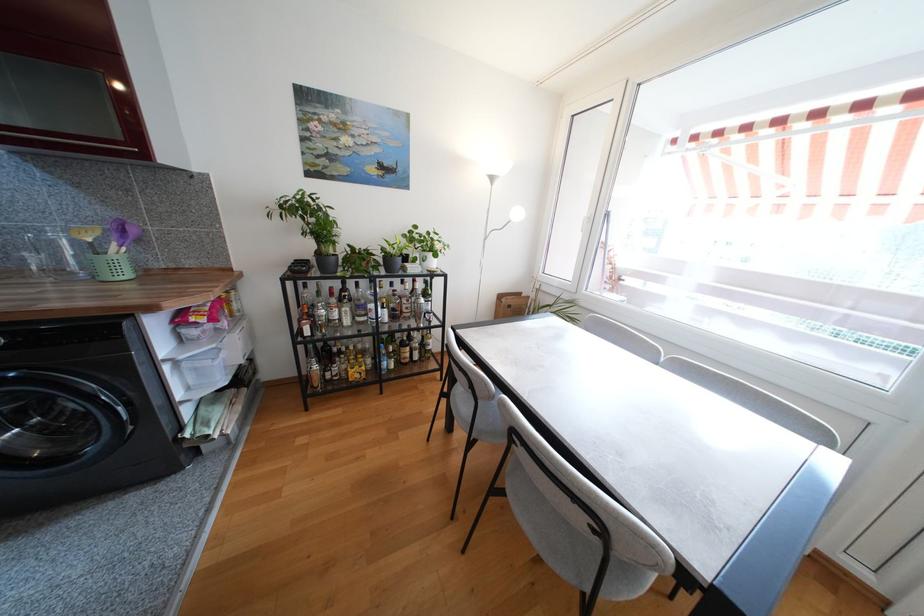
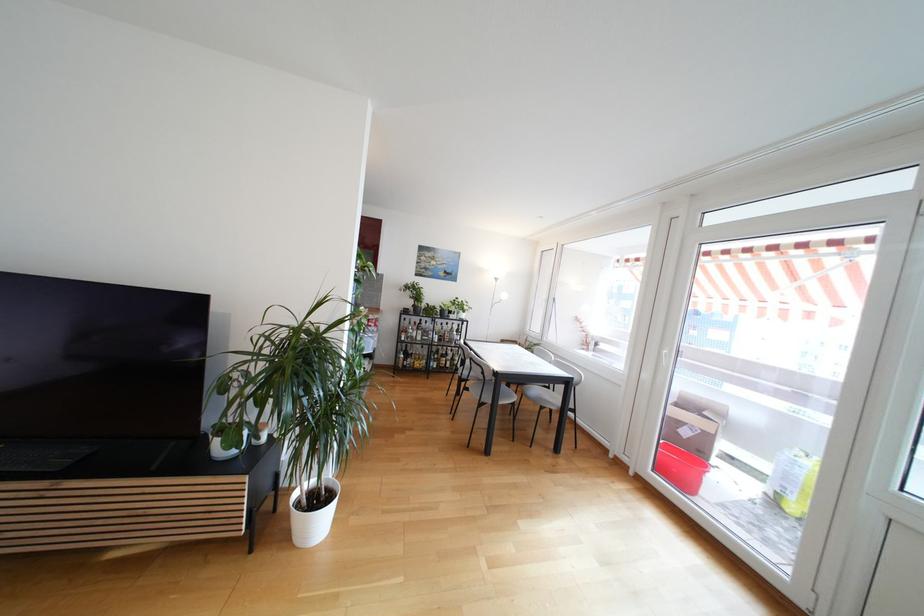
In the second image, find the point that corresponds to pixel 414 317 in the first image.

(453, 342)